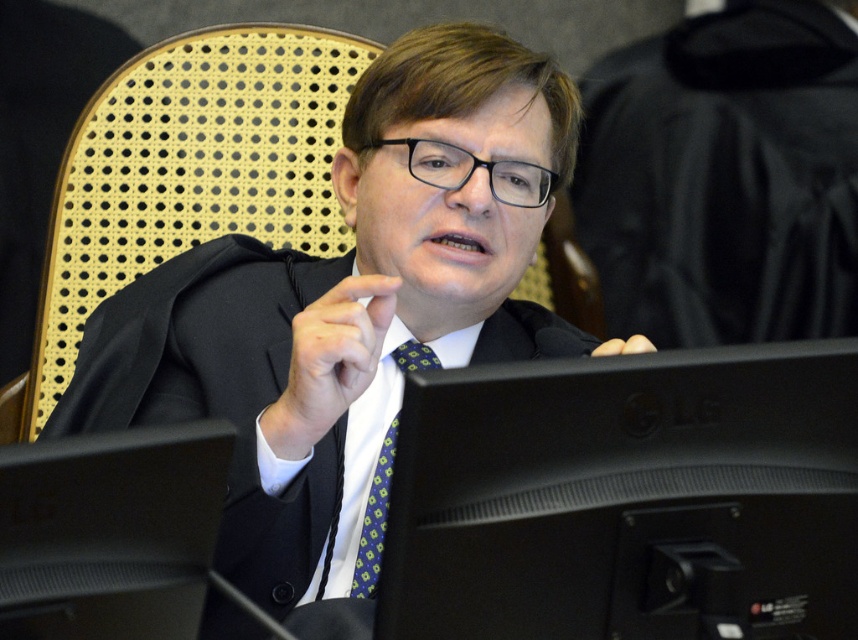
Question: Does black plastic monitor at center appear on the right side of green checkered tie at center?

Choices:
 (A) yes
 (B) no

Answer: (A)

Question: Which object appears closest to the camera in this image?

Choices:
 (A) black plastic monitor at center
 (B) green checkered tie at center
 (C) black matte suit at center

Answer: (A)

Question: Which of the following is the closest to the observer?

Choices:
 (A) green checkered tie at center
 (B) black matte suit at center
 (C) black plastic monitor at center

Answer: (C)

Question: Which point is closer to the camera?

Choices:
 (A) 363,598
 (B) 355,568

Answer: (A)

Question: Is black matte suit at center to the left of black plastic monitor at center from the viewer's perspective?

Choices:
 (A) no
 (B) yes

Answer: (B)

Question: Is black matte suit at center to the left of black plastic monitor at center from the viewer's perspective?

Choices:
 (A) yes
 (B) no

Answer: (A)